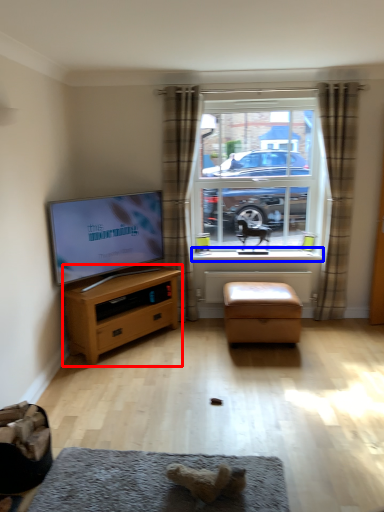
Question: Which of the following is the farthest to the observer, chest of drawers (highlighted by a red box) or window sill (highlighted by a blue box)?

Choices:
 (A) chest of drawers
 (B) window sill

Answer: (B)